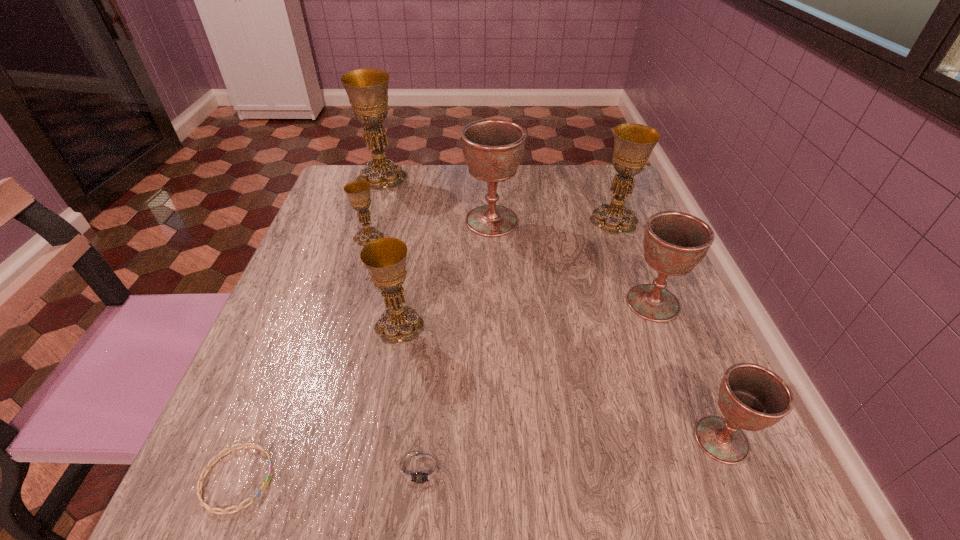
I want to click on the nearest brown chalice, so click(x=751, y=397).

The height and width of the screenshot is (540, 960). In order to click on watch in this screenshot , I will do `click(422, 470)`.

In order to click on the shortest object in this screenshot , I will do `click(200, 483)`.

Image resolution: width=960 pixels, height=540 pixels. In order to click on blue bracelet in this screenshot , I will do `click(200, 483)`.

The height and width of the screenshot is (540, 960). I want to click on free space located on the right of the biggest gold chalice, so click(499, 178).

Locate an element on the screen. This screenshot has width=960, height=540. free point located 0.240m on the front of the fourth chalice from left to right is located at coordinates (494, 317).

This screenshot has width=960, height=540. Find the location of `vacant point located 0.170m on the right of the third biggest gold chalice`. vacant point located 0.170m on the right of the third biggest gold chalice is located at coordinates (516, 326).

At what (x,y) coordinates should I click in order to perform the action: click on vacant space situated 0.160m on the front of the second farthest brown chalice. Please return your answer as a coordinate pair (x, y). Looking at the image, I should click on (691, 400).

At what (x,y) coordinates should I click in order to perform the action: click on vacant space located 0.100m on the right of the smallest gold chalice. Please return your answer as a coordinate pair (x, y). This screenshot has height=540, width=960. Looking at the image, I should click on (428, 238).

The width and height of the screenshot is (960, 540). In order to click on free region located 0.240m on the back of the nearest chalice in this screenshot , I will do `click(664, 303)`.